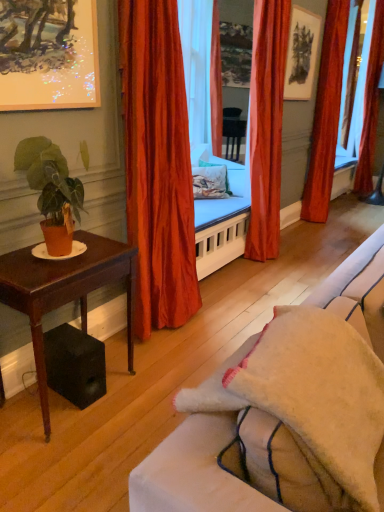
Find the location of a particular element. spots to the right of satin orange curtain at center, the fourth curtain positioned from the back is located at coordinates (222, 317).